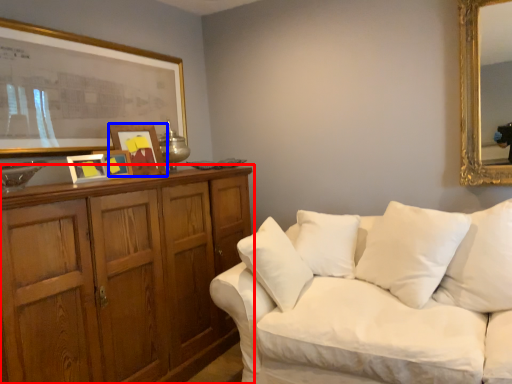
Question: Which of the following is the closest to the observer, cabinetry (highlighted by a red box) or picture frame (highlighted by a blue box)?

Choices:
 (A) cabinetry
 (B) picture frame

Answer: (A)